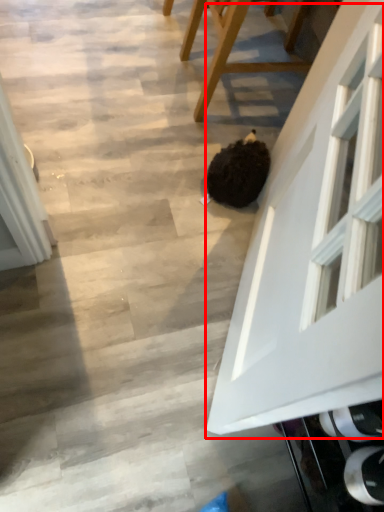
Question: From the image's perspective, where is glass door (annotated by the red box) located in relation to furniture in the image?

Choices:
 (A) above
 (B) below

Answer: (B)